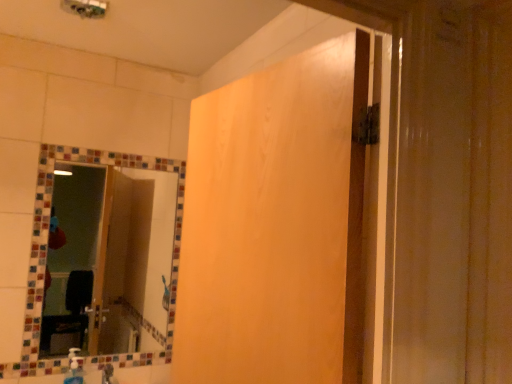
Question: Choose the correct answer: Is multicolored mosaic mirror at upper left inside wooden panel at center or outside it?

Choices:
 (A) inside
 (B) outside

Answer: (B)

Question: In terms of width, does multicolored mosaic mirror at upper left look wider or thinner when compared to wooden panel at center?

Choices:
 (A) wide
 (B) thin

Answer: (B)

Question: Which is nearer to the wooden panel at center?

Choices:
 (A) multicolored mosaic mirror at upper left
 (B) translucent plastic soap dispenser at lower left

Answer: (A)

Question: Which object is positioned farthest from the wooden panel at center?

Choices:
 (A) multicolored mosaic mirror at upper left
 (B) translucent plastic soap dispenser at lower left

Answer: (B)